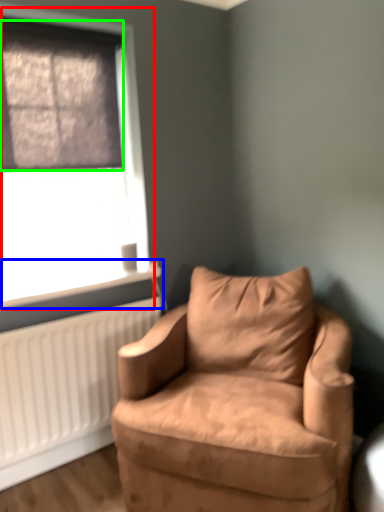
Question: Which object is the farthest from window (highlighted by a red box)? Choose among these: window sill (highlighted by a blue box) or window screen (highlighted by a green box).

Choices:
 (A) window sill
 (B) window screen

Answer: (A)